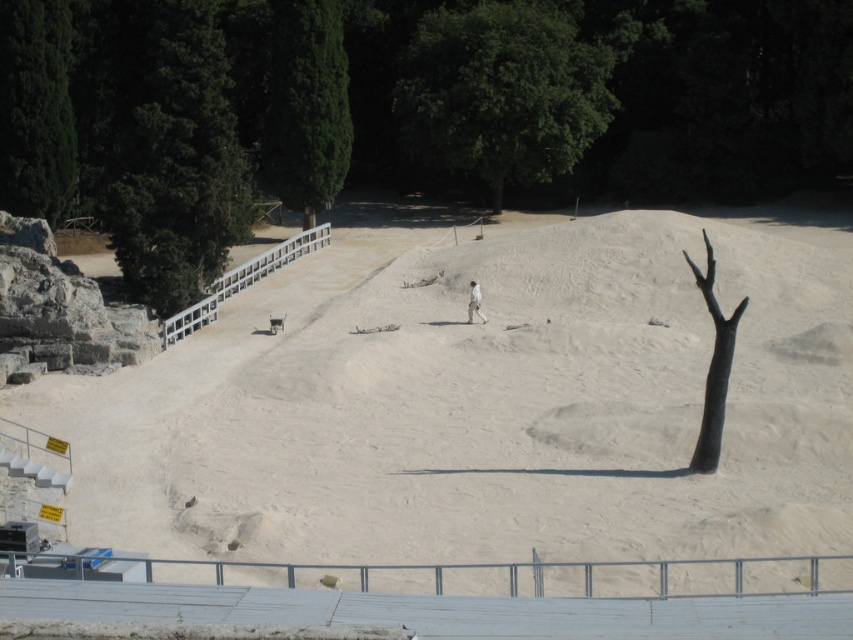
Who is more distant from viewer, [190,209] or [219,282]?

The point [219,282] is more distant.

Is dark green leafy tree at upper left thinner than white plastic fence at upper center?

No, dark green leafy tree at upper left is not thinner than white plastic fence at upper center.

Find the location of a particular element. dark green leafy tree at upper left is located at coordinates (164, 147).

Who is more distant from viewer, [315,236] or [474,291]?

The point [315,236] is behind.

Find the location of a particular element. This screenshot has width=853, height=640. white plastic fence at upper center is located at coordinates (241, 282).

Where is `white plastic fence at upper center`? This screenshot has width=853, height=640. white plastic fence at upper center is located at coordinates (241, 282).

This screenshot has width=853, height=640. What do you see at coordinates (508, 573) in the screenshot?
I see `metallic silver fence at lower center` at bounding box center [508, 573].

Identify the location of metallic silver fence at lower center. The width and height of the screenshot is (853, 640). (508, 573).